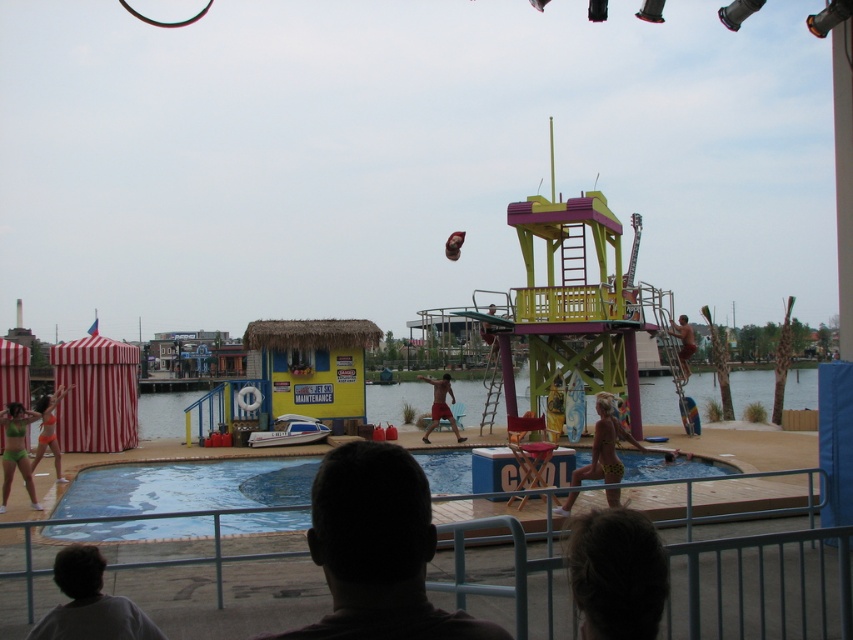
Can you confirm if orange bikini at center is wider than smooth tan skin at right?

Correct, the width of orange bikini at center exceeds that of smooth tan skin at right.

Is orange bikini at center to the left of smooth tan skin at right from the viewer's perspective?

Correct, you'll find orange bikini at center to the left of smooth tan skin at right.

Is point (55, 470) closer to viewer compared to point (688, 371)?

Yes.

The image size is (853, 640). I want to click on orange bikini at center, so click(49, 429).

Does point (608, 436) come in front of point (450, 417)?

Yes, it is in front of point (450, 417).

Which is above, yellow-green swimsuit at center or reddish-brown skin at center?

Positioned higher is yellow-green swimsuit at center.

Between point (610, 419) and point (444, 404), which one is positioned in front?

Point (610, 419)

Find the location of a particular element. yellow-green swimsuit at center is located at coordinates (604, 444).

Is point (120, 636) positioned in front of point (56, 456)?

Yes.

Is white matte shirt at lower left thinner than orange bikini at center?

Yes, white matte shirt at lower left is thinner than orange bikini at center.

At what (x,y) coordinates should I click in order to perform the action: click on white matte shirt at lower left. Please return your answer as a coordinate pair (x, y). The height and width of the screenshot is (640, 853). Looking at the image, I should click on (90, 604).